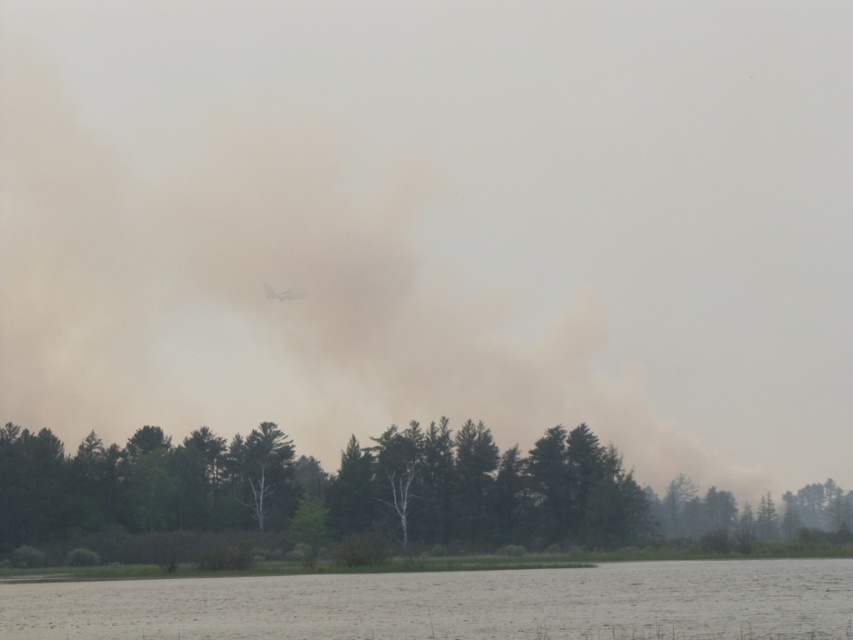
Between green matte tree at center and gray matte water at lower center, which one appears on the left side from the viewer's perspective?

gray matte water at lower center

What do you see at coordinates (374, 493) in the screenshot? The height and width of the screenshot is (640, 853). I see `green matte tree at center` at bounding box center [374, 493].

Find the location of a particular element. This screenshot has height=640, width=853. green matte tree at center is located at coordinates (374, 493).